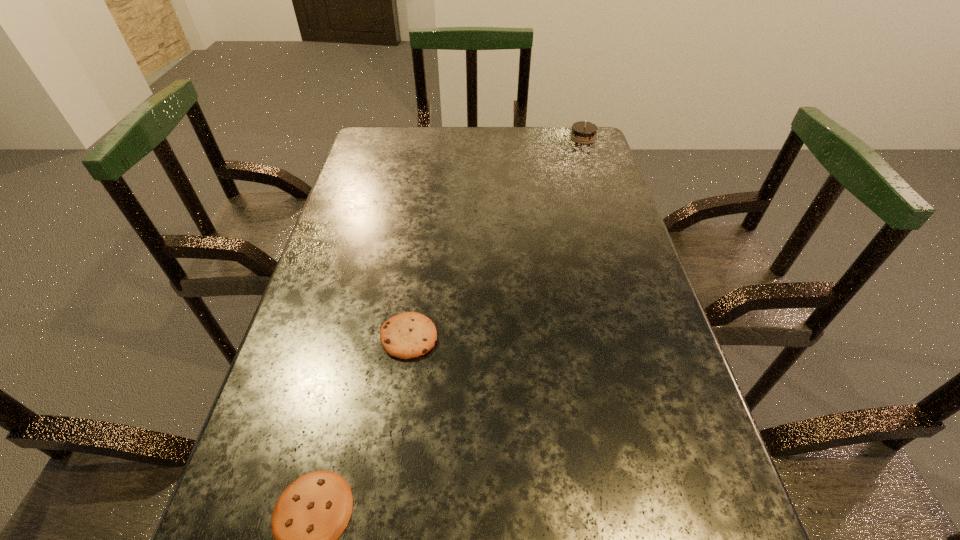
This screenshot has height=540, width=960. Identify the location of the rightmost object. (583, 132).

The width and height of the screenshot is (960, 540). I want to click on the farthest object, so click(583, 132).

I want to click on the farther cookie, so click(x=408, y=335).

Locate an element on the screen. The image size is (960, 540). the taller cookie is located at coordinates (408, 335).

This screenshot has width=960, height=540. I want to click on blank space located on the front of the chocolate cake, so 593,171.

Locate an element on the screen. Image resolution: width=960 pixels, height=540 pixels. vacant space located on the front of the taller cookie is located at coordinates (400, 399).

I want to click on object that is at the far edge, so click(x=583, y=132).

Find the location of a particular element. This screenshot has height=540, width=960. object positioned at the right edge is located at coordinates (583, 132).

The width and height of the screenshot is (960, 540). Identify the location of object that is at the far right corner. (583, 132).

This screenshot has width=960, height=540. Identify the location of free space at the far edge of the desktop. (444, 132).